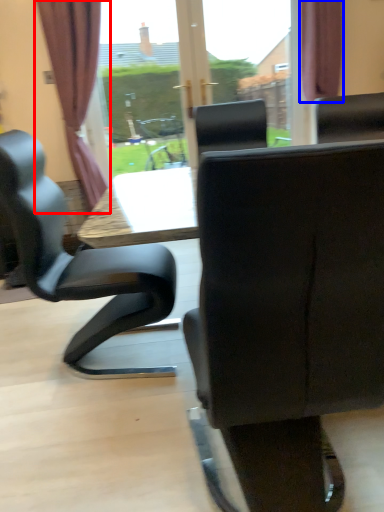
Question: Among these objects, which one is farthest to the camera, curtain (highlighted by a red box) or curtain (highlighted by a blue box)?

Choices:
 (A) curtain
 (B) curtain

Answer: (B)